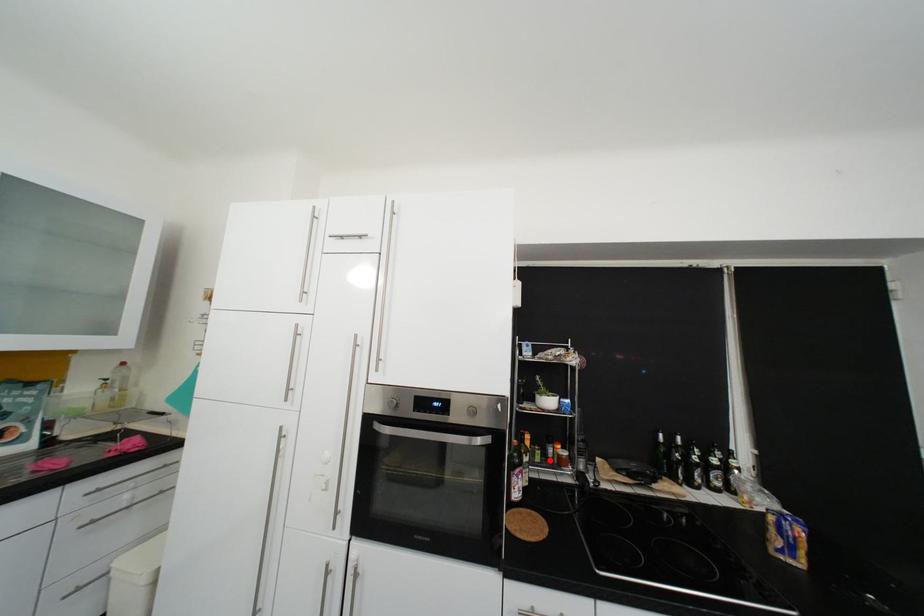
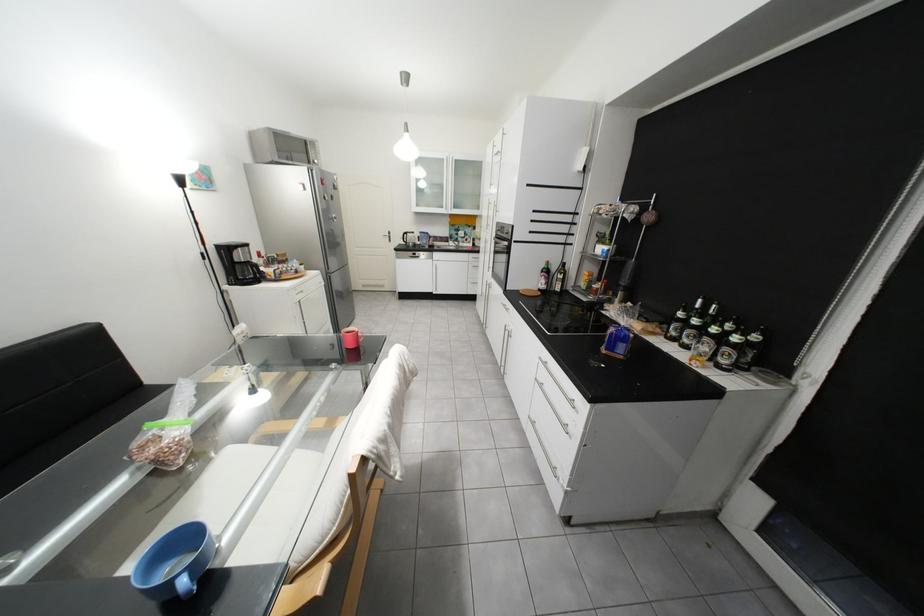
Question: I am providing you with two images of the same scene from different viewpoints. Given a red point in image1, look at the same physical point in image2. Is it:

Choices:
 (A) Closer to the viewpoint
 (B) Farther from the viewpoint

Answer: (A)